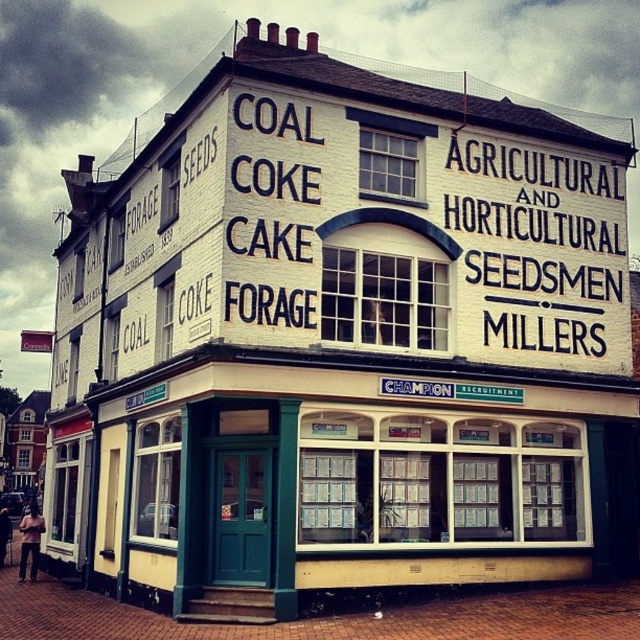
Can you confirm if matte green door at center is wider than black painted sign at center?

Yes.

Is point (401, 579) less distant than point (236, 180)?

That is False.

Identify the location of matte green door at center. The height and width of the screenshot is (640, 640). (356, 474).

Which is above, black painted sign at upper right or black painted sign at center?

black painted sign at center is above.

How distant is black painted sign at upper right from black painted sign at center?

The distance of black painted sign at upper right from black painted sign at center is 10.75 meters.

Identify the location of black painted sign at upper right. (541, 225).

You are a GUI agent. You are given a task and a screenshot of the screen. Output one action in this format:
    pyautogui.click(x=<x>, y=<y>)
    Task: Click on the black painted sign at upper right
    The height and width of the screenshot is (640, 640).
    Given the screenshot: What is the action you would take?
    pyautogui.click(x=541, y=225)

Who is shorter, matte green door at center or black painted sign at upper right?

Standing shorter between the two is black painted sign at upper right.

Which is in front, point (186, 365) or point (570, 243)?

Point (186, 365) is more forward.

What do you see at coordinates (356, 474) in the screenshot? Image resolution: width=640 pixels, height=640 pixels. I see `matte green door at center` at bounding box center [356, 474].

Find the location of a particular element. The image size is (640, 640). matte green door at center is located at coordinates (356, 474).